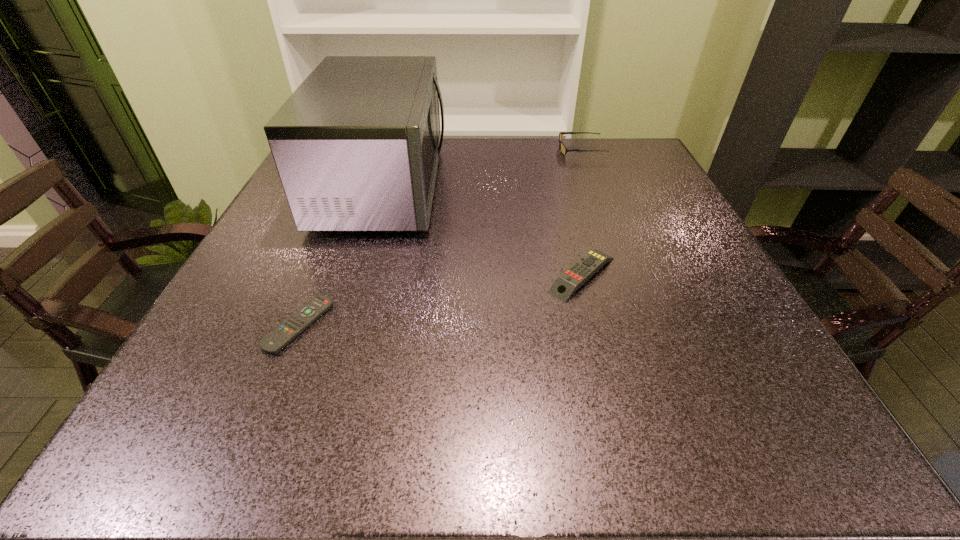
Find the location of a particular element. the tallest object is located at coordinates (356, 146).

Find the location of a particular element. The height and width of the screenshot is (540, 960). the third shortest object is located at coordinates (564, 150).

This screenshot has width=960, height=540. What are the coordinates of `the right remote control` in the screenshot? It's located at (565, 285).

Where is `the second shortest object`? Image resolution: width=960 pixels, height=540 pixels. the second shortest object is located at coordinates (565, 285).

Where is `the shorter remote control`? The image size is (960, 540). the shorter remote control is located at coordinates (300, 320).

The height and width of the screenshot is (540, 960). What are the coordinates of `the left remote control` in the screenshot? It's located at (300, 320).

Locate an element on the screen. free space located 0.180m on the front-facing side of the microwave oven is located at coordinates (517, 187).

Where is `vacant space situated on the front-facing side of the second tallest object`? vacant space situated on the front-facing side of the second tallest object is located at coordinates (415, 150).

In order to click on vacant space situated on the front-facing side of the second tallest object in this screenshot , I will do `click(508, 150)`.

Find the location of a particular element. This screenshot has width=960, height=540. free space located 0.290m on the front-facing side of the second tallest object is located at coordinates (454, 150).